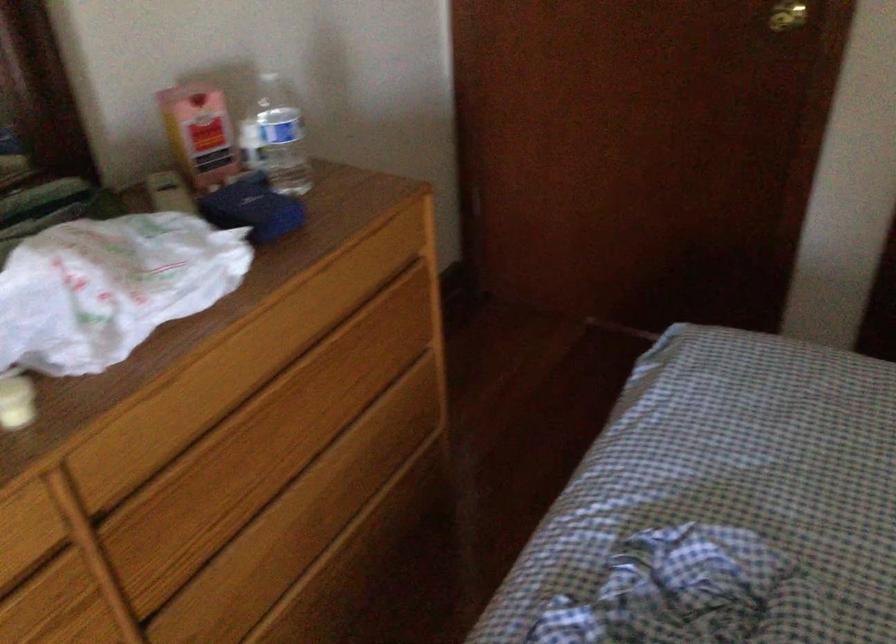
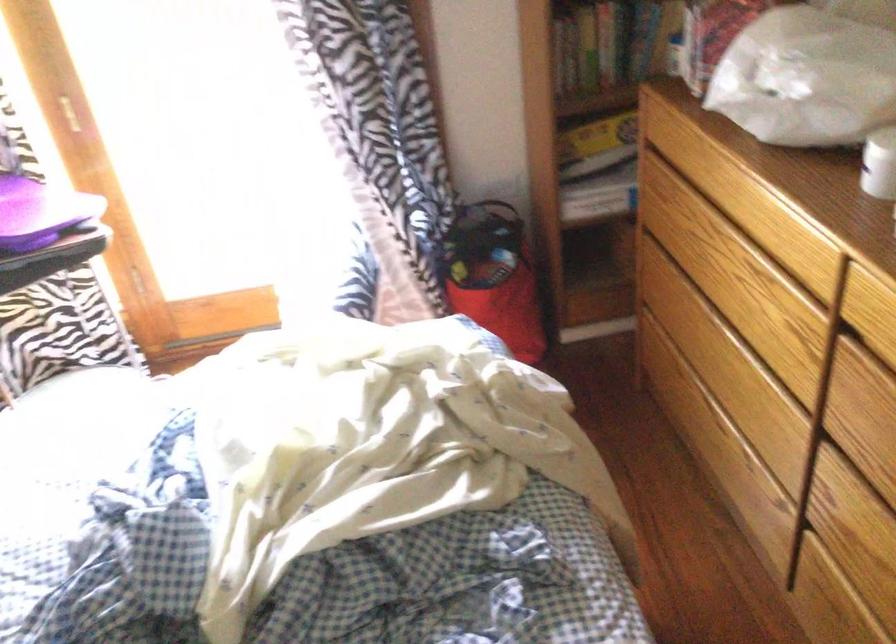
The point at (195, 552) is marked in the first image. Where is the corresponding point in the second image?

(868, 460)